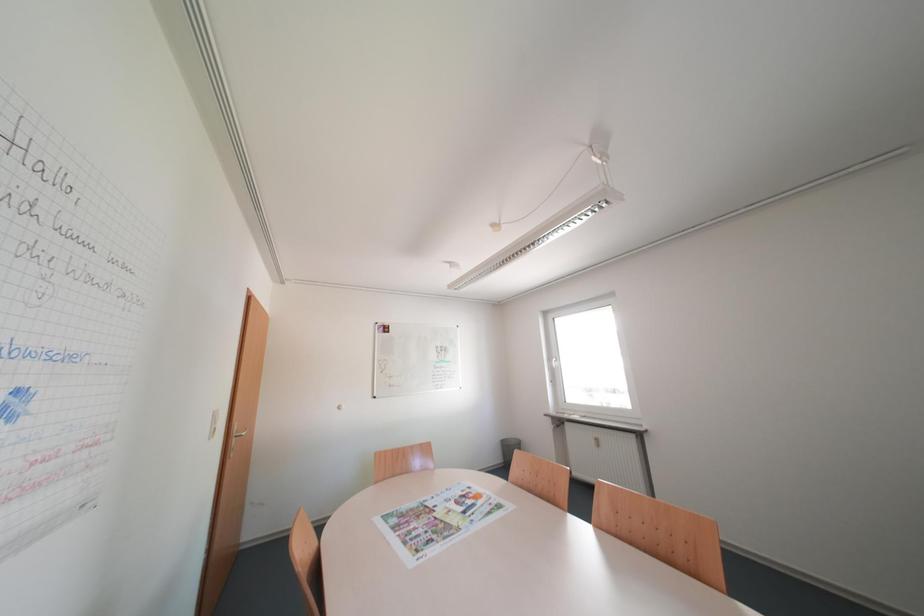
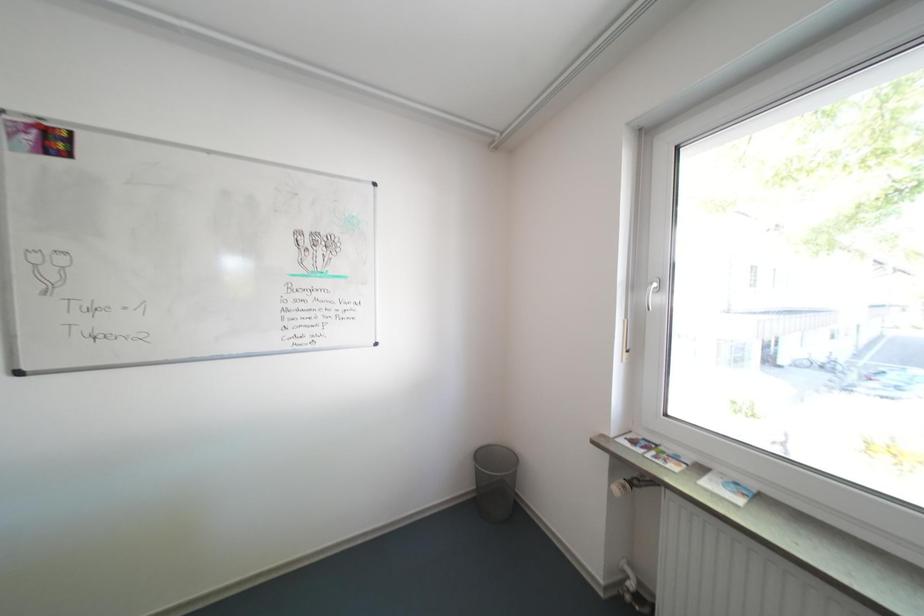
Question: Which direction would the cameraman need to move to produce the second image? Reply with the corresponding letter.

Choices:
 (A) Left
 (B) Right
 (C) Forward
 (D) Backward

Answer: (C)